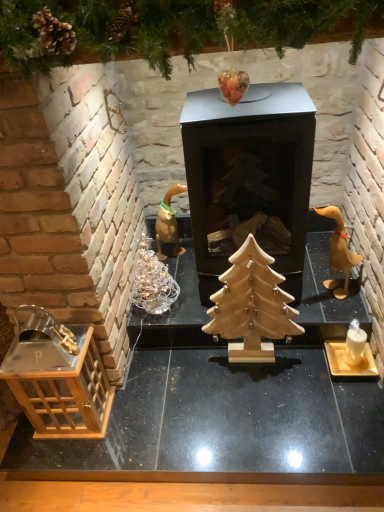
Identify the location of vacant space positioned to the left of matte gold candle holder at lower right. This screenshot has width=384, height=512. (306, 377).